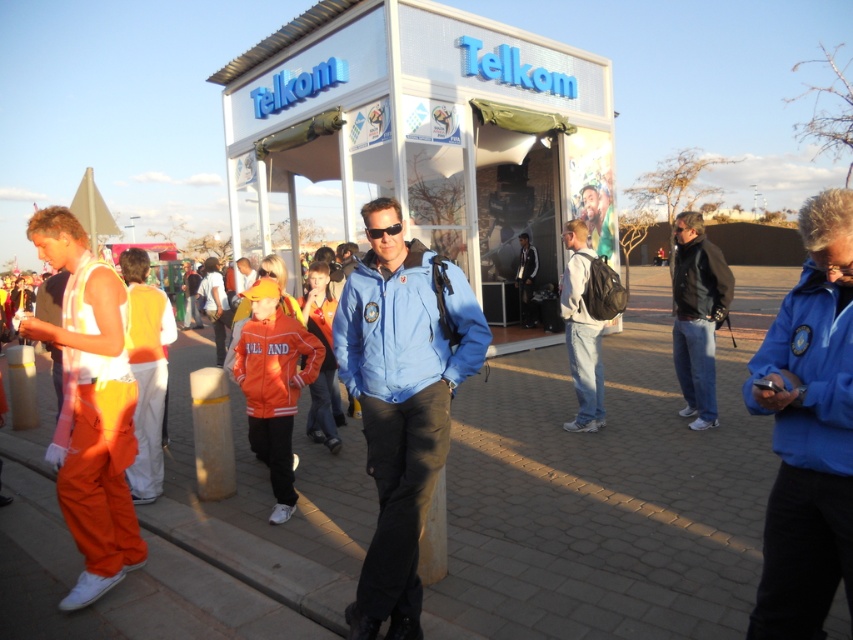
Is dark blue leather jacket at center closer to camera compared to orange fleece jacket at center?

No, it is behind orange fleece jacket at center.

This screenshot has height=640, width=853. In order to click on dark blue leather jacket at center in this screenshot , I will do `click(697, 317)`.

Between blue fabric jacket at center and matte black goggles at center, which one has more height?

With more height is blue fabric jacket at center.

Image resolution: width=853 pixels, height=640 pixels. Describe the element at coordinates (402, 406) in the screenshot. I see `blue fabric jacket at center` at that location.

Locate an element on the screen. This screenshot has width=853, height=640. blue fabric jacket at center is located at coordinates (402, 406).

Does blue smooth jacket at right appear under dark blue leather jacket at center?

Indeed, blue smooth jacket at right is positioned under dark blue leather jacket at center.

Between blue smooth jacket at right and dark blue leather jacket at center, which one appears on the right side from the viewer's perspective?

dark blue leather jacket at center

Is point (828, 465) positioned before point (694, 257)?

Yes.

Image resolution: width=853 pixels, height=640 pixels. I want to click on blue smooth jacket at right, so click(809, 374).